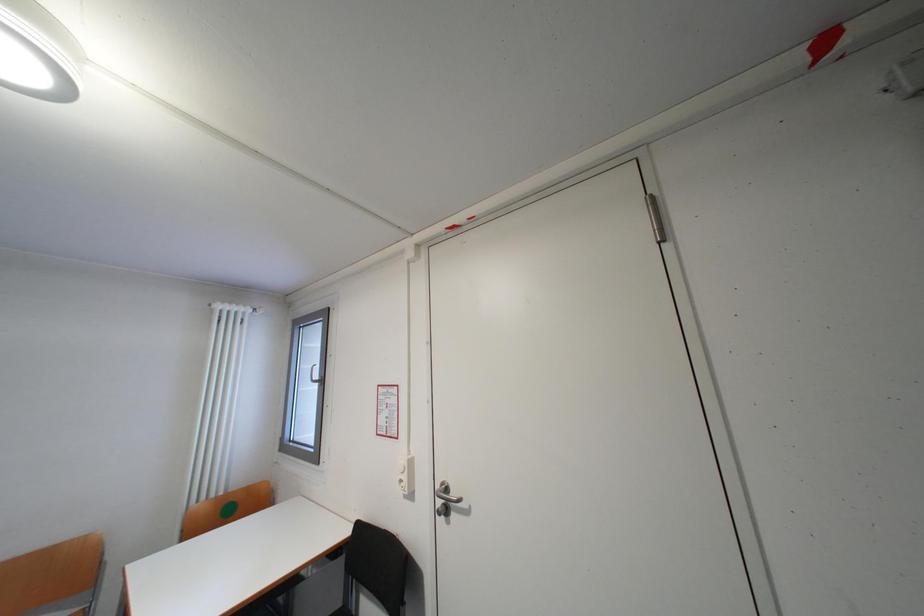
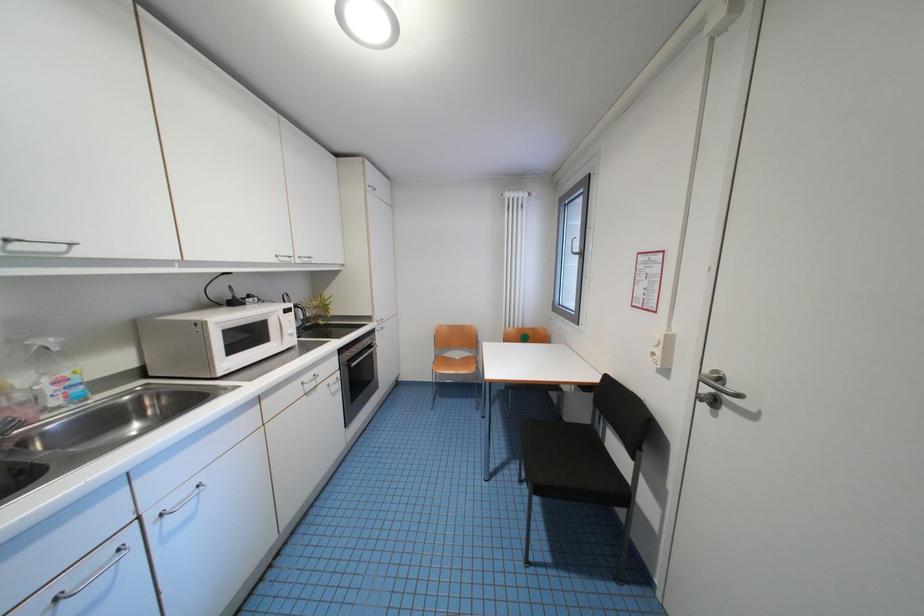
Based on the continuous images, in which direction is the camera rotating?

The rotation direction of the camera is left-down.